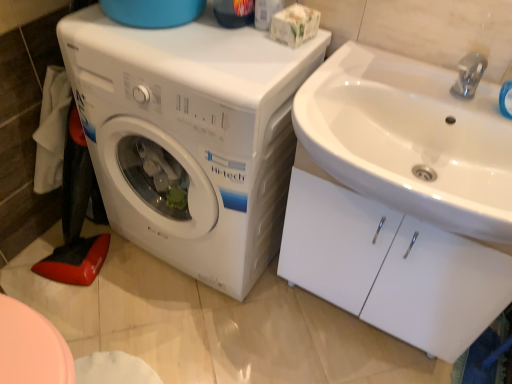
This screenshot has width=512, height=384. Find the location of `free spot to the left of white glossy sink at upper right`. free spot to the left of white glossy sink at upper right is located at coordinates (254, 334).